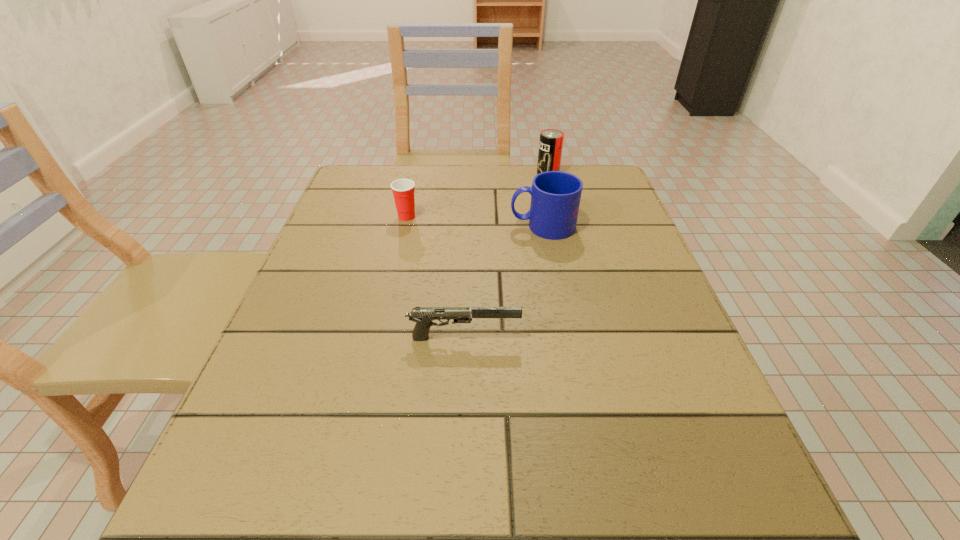
I want to click on vacant space situated 0.200m at the muzzle end of the gun, so click(637, 338).

Where is `can that is at the far edge`? can that is at the far edge is located at coordinates (551, 140).

At what (x,y) coordinates should I click in order to perform the action: click on Dixie cup located at the far edge. Please return your answer as a coordinate pair (x, y). Image resolution: width=960 pixels, height=540 pixels. Looking at the image, I should click on (403, 190).

This screenshot has height=540, width=960. Identify the location of object that is at the left edge. (403, 190).

Where is `can present at the right edge`? can present at the right edge is located at coordinates (551, 140).

Identify the location of mug located at the right edge. (555, 195).

Where is `object that is at the far left corner`? The image size is (960, 540). object that is at the far left corner is located at coordinates pyautogui.click(x=403, y=190).

This screenshot has width=960, height=540. What are the coordinates of `object that is at the far right corner` in the screenshot? It's located at (551, 140).

In the image, there is a desktop. Where is `vacant space at the far edge`? The width and height of the screenshot is (960, 540). vacant space at the far edge is located at coordinates (494, 177).

This screenshot has height=540, width=960. What are the coordinates of `vacant space at the near edge` in the screenshot? It's located at (332, 533).